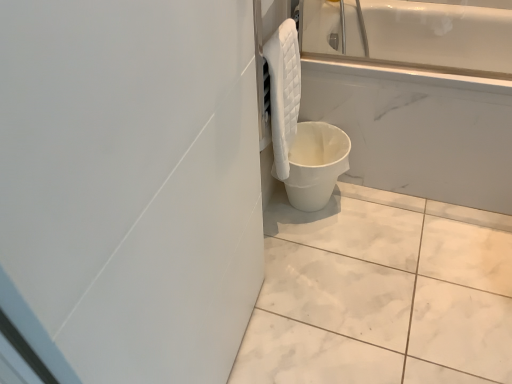
Question: Is white marble tile at lower center to the right of white matte bucket at lower right from the viewer's perspective?

Choices:
 (A) yes
 (B) no

Answer: (A)

Question: From a real-world perspective, is white marble tile at lower center over white matte bucket at lower right?

Choices:
 (A) yes
 (B) no

Answer: (B)

Question: Is white matte bucket at lower right inside white marble tile at lower center?

Choices:
 (A) yes
 (B) no

Answer: (B)

Question: Is white marble tile at lower center oriented away from white matte bucket at lower right?

Choices:
 (A) yes
 (B) no

Answer: (B)

Question: Is white marble tile at lower center oriented towards white matte bucket at lower right?

Choices:
 (A) yes
 (B) no

Answer: (B)

Question: Does white marble tile at lower center have a greater width compared to white matte bucket at lower right?

Choices:
 (A) no
 (B) yes

Answer: (B)

Question: Is white marble tile at lower center to the right of white quilted towel at upper right from the viewer's perspective?

Choices:
 (A) yes
 (B) no

Answer: (A)

Question: Can you confirm if white marble tile at lower center is shorter than white quilted towel at upper right?

Choices:
 (A) yes
 (B) no

Answer: (A)

Question: Is white quilted towel at upper right inside white marble tile at lower center?

Choices:
 (A) no
 (B) yes

Answer: (A)

Question: Can we say white marble tile at lower center lies outside white quilted towel at upper right?

Choices:
 (A) yes
 (B) no

Answer: (A)

Question: From a real-world perspective, is white marble tile at lower center on top of white quilted towel at upper right?

Choices:
 (A) yes
 (B) no

Answer: (B)

Question: Is white marble tile at lower center taller than white quilted towel at upper right?

Choices:
 (A) yes
 (B) no

Answer: (B)

Question: From a real-world perspective, is white matte bucket at lower right located beneath white marble tile at lower center?

Choices:
 (A) yes
 (B) no

Answer: (B)